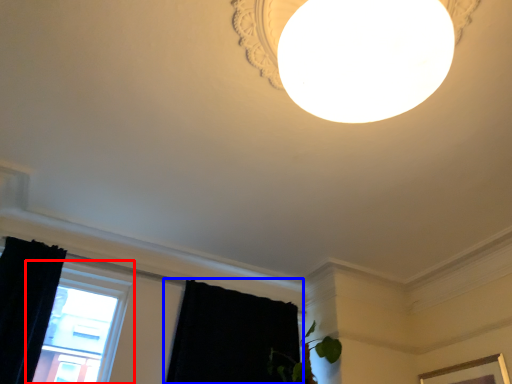
Question: Which point is closer to the camera, window (highlighted by a red box) or curtain (highlighted by a blue box)?

Choices:
 (A) window
 (B) curtain

Answer: (A)